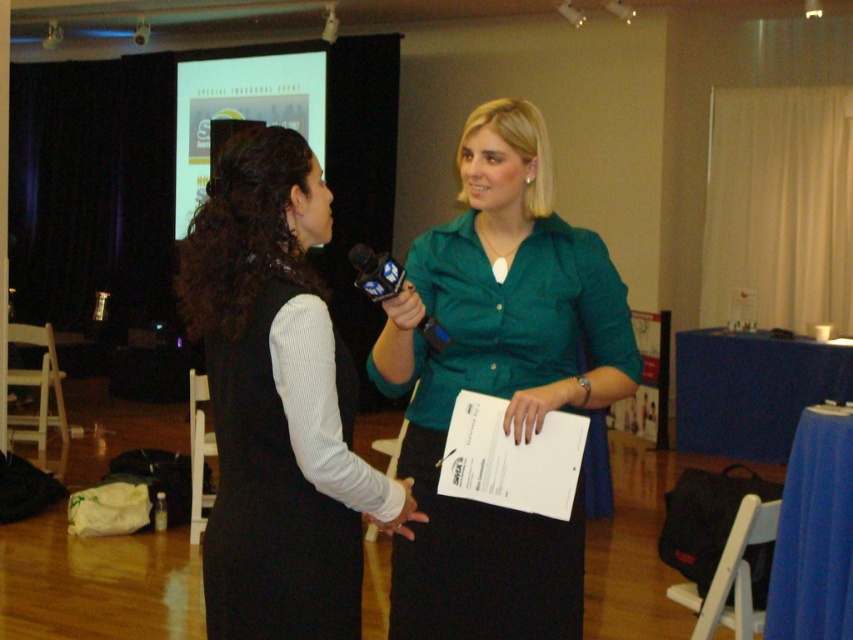
Is black matte dress at center shorter than black ribbed fabric dress at center?

No, black matte dress at center is not shorter than black ribbed fabric dress at center.

How much distance is there between black matte dress at center and black ribbed fabric dress at center?

The distance of black matte dress at center from black ribbed fabric dress at center is 1.30 inches.

The height and width of the screenshot is (640, 853). Find the location of `black matte dress at center`. black matte dress at center is located at coordinates (277, 403).

Can you confirm if black ribbed fabric dress at center is positioned below black plastic microphone at center?

Indeed, black ribbed fabric dress at center is positioned under black plastic microphone at center.

Between black ribbed fabric dress at center and black plastic microphone at center, which one has more height?

black ribbed fabric dress at center is taller.

Describe the element at coordinates (270, 506) in the screenshot. The width and height of the screenshot is (853, 640). I see `black ribbed fabric dress at center` at that location.

What are the coordinates of `black ribbed fabric dress at center` in the screenshot? It's located at (270, 506).

Is green matte shirt at center smaller than black ribbed fabric dress at center?

No.

Which is in front, point (393, 592) or point (267, 602)?

Point (267, 602) is in front.

Locate an element on the screen. Image resolution: width=853 pixels, height=640 pixels. green matte shirt at center is located at coordinates (498, 384).